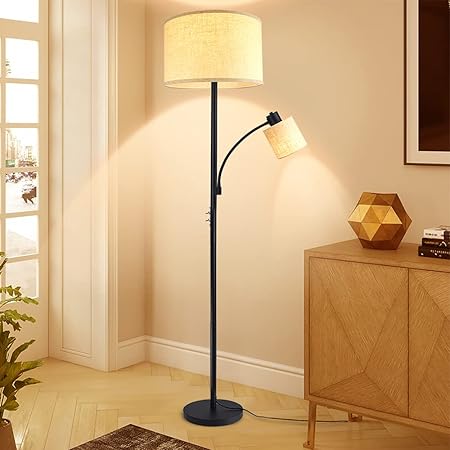
Identify the location of books. The height and width of the screenshot is (450, 450). (433, 233), (431, 247), (433, 254).